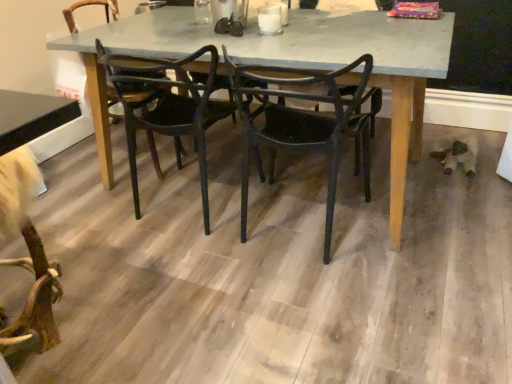
Question: Should I look upward or downward to see black matte chair at center, positioned as the second chair in left-to-right order?

Choices:
 (A) down
 (B) up

Answer: (B)

Question: Does matte gray table at center touch black plastic chair at center, which ranks as the first chair in left-to-right order?

Choices:
 (A) no
 (B) yes

Answer: (A)

Question: Considering the relative sizes of matte gray table at center and black plastic chair at center, the second chair when ordered from right to left, in the image provided, is matte gray table at center smaller than black plastic chair at center, the second chair when ordered from right to left,?

Choices:
 (A) yes
 (B) no

Answer: (B)

Question: Is matte gray table at center wider than black plastic chair at center, which ranks as the first chair in left-to-right order?

Choices:
 (A) no
 (B) yes

Answer: (B)

Question: Does matte gray table at center appear on the left side of black plastic chair at center, which ranks as the first chair in left-to-right order?

Choices:
 (A) no
 (B) yes

Answer: (A)

Question: From the image's perspective, would you say matte gray table at center is shown under black plastic chair at center, which ranks as the first chair in left-to-right order?

Choices:
 (A) no
 (B) yes

Answer: (A)

Question: Does matte gray table at center have a larger size compared to black plastic chair at center, the second chair when ordered from right to left?

Choices:
 (A) yes
 (B) no

Answer: (A)

Question: Is wooden floor at center not close to black matte chair at center, the first chair from the right?

Choices:
 (A) yes
 (B) no

Answer: (B)

Question: Is wooden floor at center aimed at black matte chair at center, positioned as the second chair in left-to-right order?

Choices:
 (A) no
 (B) yes

Answer: (A)

Question: Is wooden floor at center shorter than black matte chair at center, the first chair from the right?

Choices:
 (A) yes
 (B) no

Answer: (A)

Question: Does wooden floor at center come behind black matte chair at center, the first chair from the right?

Choices:
 (A) yes
 (B) no

Answer: (B)

Question: From the image's perspective, would you say wooden floor at center is positioned over black matte chair at center, the first chair from the right?

Choices:
 (A) no
 (B) yes

Answer: (A)

Question: Does wooden floor at center appear on the right side of black matte chair at center, the first chair from the right?

Choices:
 (A) no
 (B) yes

Answer: (A)

Question: Is black matte chair at center, the first chair from the right, thinner than wooden floor at center?

Choices:
 (A) no
 (B) yes

Answer: (B)